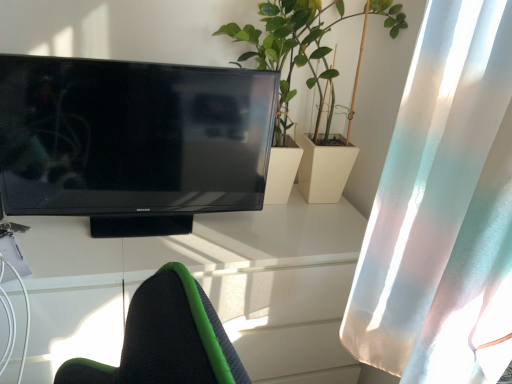
The image size is (512, 384). In order to click on free point above white glossy desk at center (from a real-world perspective) in this screenshot , I will do `click(226, 225)`.